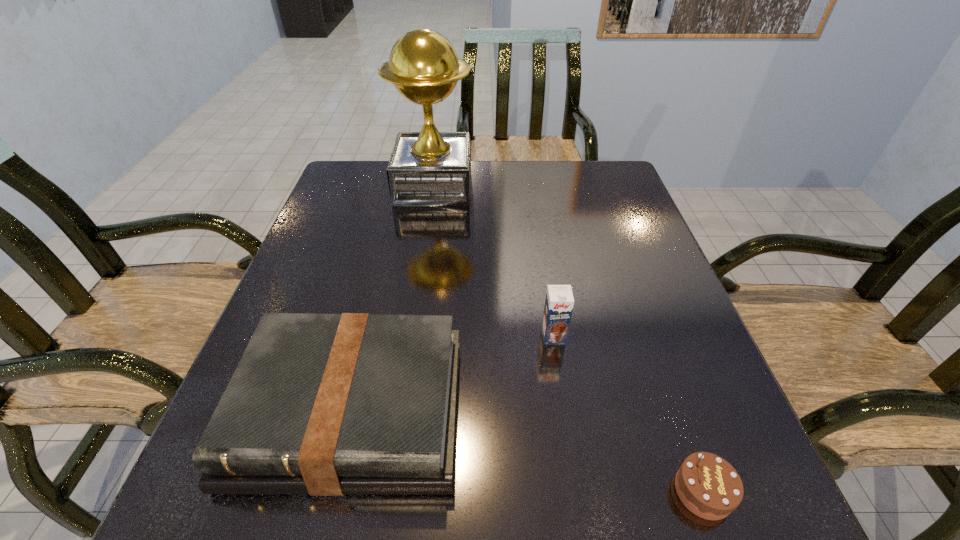
I want to click on award, so click(429, 168).

Where is `the farthest object`? This screenshot has height=540, width=960. the farthest object is located at coordinates point(429,168).

The width and height of the screenshot is (960, 540). Identify the location of chocolate milk. (559, 302).

Where is `the third object from left to right`? The width and height of the screenshot is (960, 540). the third object from left to right is located at coordinates (559, 302).

You are a GUI agent. You are given a task and a screenshot of the screen. Output one action in this format:
    pyautogui.click(x=<x>, y=<y>)
    Task: Click on the hardback book
    The image size is (960, 540).
    Given the screenshot: What is the action you would take?
    pyautogui.click(x=355, y=403)

Where is `chocolate cake`? This screenshot has width=960, height=540. chocolate cake is located at coordinates (707, 485).

This screenshot has height=540, width=960. What are the coordinates of `the rightmost object` in the screenshot? It's located at (707, 485).

At what (x,y) coordinates should I click in order to perform the action: click on vacant region located 0.050m on the front-facing side of the award. Please return your answer as a coordinate pair (x, y). Looking at the image, I should click on (491, 186).

Where is `vacant area situated on the front label of the third object from left to right`? The width and height of the screenshot is (960, 540). vacant area situated on the front label of the third object from left to right is located at coordinates (574, 471).

I want to click on free location located on the left of the shortest object, so click(415, 491).